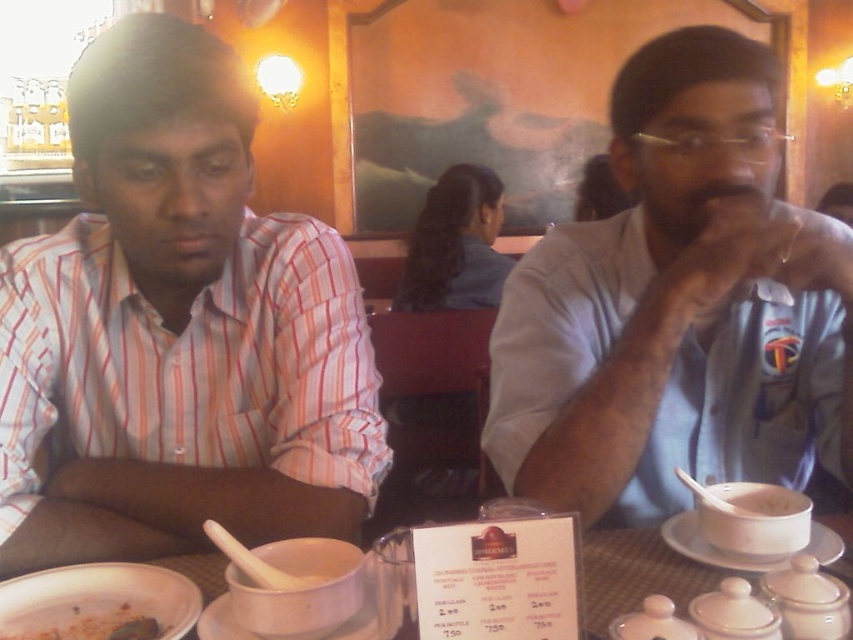
You are a waiter in a restaurant and need to serve a customer. You have a porcelain white bowl at center and white matte rice at right on the table. Which item should you pick up first to ensure proper serving size?

The porcelain white bowl at center should be picked up first because it might be wider than the white matte rice at right, allowing for the correct portion of rice to be served.

You are a server in a restaurant and need to deliver a drink to the customer wearing the light blue shirt at center. The drink is currently placed on the dirty white plate at lower left. Can you reach the drink without moving the plate?

The distance between the light blue shirt at center and the dirty white plate at lower left is 23.76 inches, so yes, you can reach the drink from the dirty white plate at lower left to the light blue shirt at center without moving the plate as the distance is manageable for a server to handle.